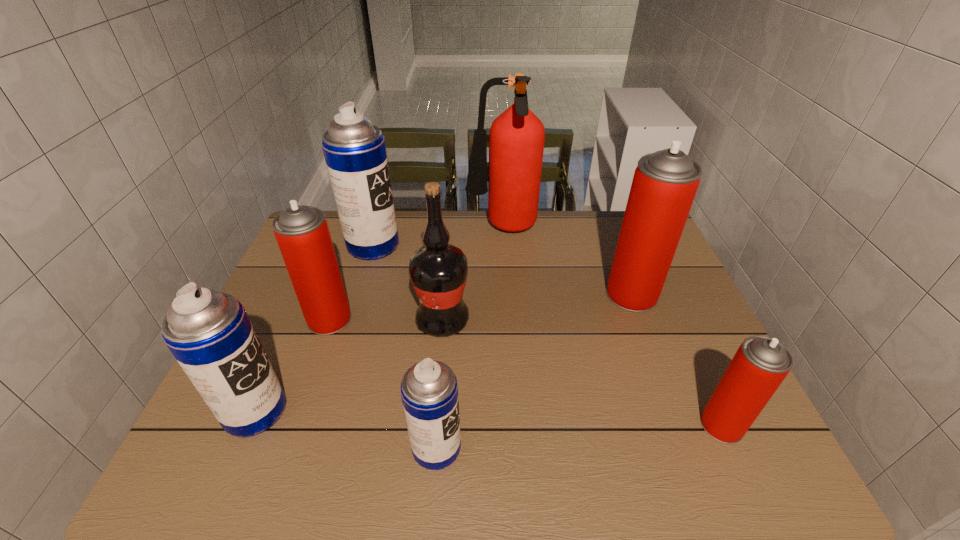
The image size is (960, 540). I want to click on the second closest object to the second smallest blue aerosol can, so click(x=429, y=390).

You are a GUI agent. You are given a task and a screenshot of the screen. Output one action in this format:
    pyautogui.click(x=<x>, y=<y>)
    Task: Click on the object that ranks as the sixth closest to the biggest red aerosol can
    The image size is (960, 540).
    Given the screenshot: What is the action you would take?
    pyautogui.click(x=302, y=233)

Identify which aerosol can is the nearest to the biggest red aerosol can. Please provide its 2D coordinates. Your answer should be formatted as a tuple, i.e. [(x, y)], where the tuple contains the x and y coordinates of a point satisfying the conditions above.

[(760, 365)]

At what (x,y) coordinates should I click in order to perform the action: click on aerosol can that is the third closest to the red fire extinguisher. Please return your answer as a coordinate pair (x, y). This screenshot has height=540, width=960. Looking at the image, I should click on (302, 233).

Select which blue aerosol can appears as the closest to the biggest red aerosol can. Please provide its 2D coordinates. Your answer should be formatted as a tuple, i.e. [(x, y)], where the tuple contains the x and y coordinates of a point satisfying the conditions above.

[(429, 390)]

Image resolution: width=960 pixels, height=540 pixels. I want to click on the second closest blue aerosol can to the red wine bottle, so click(x=429, y=390).

The height and width of the screenshot is (540, 960). What are the coordinates of `red aerosol can identified as the closest to the smallest blue aerosol can` in the screenshot? It's located at (302, 233).

Point out which red aerosol can is positioned as the nearest to the red fire extinguisher. Please provide its 2D coordinates. Your answer should be formatted as a tuple, i.e. [(x, y)], where the tuple contains the x and y coordinates of a point satisfying the conditions above.

[(664, 185)]

You are a GUI agent. You are given a task and a screenshot of the screen. Output one action in this format:
    pyautogui.click(x=<x>, y=<y>)
    Task: Click on the free spot that satisfies the following two spatial constraints: 1. on the back side of the biggest red aerosol can; 2. at the nozzle of the red fire extinguisher
    
    Given the screenshot: What is the action you would take?
    pyautogui.click(x=608, y=230)

Locate an element on the screen. The image size is (960, 540). vacant space that satisfies the following two spatial constraints: 1. on the back side of the nearest red aerosol can; 2. at the nozzle of the red fire extinguisher is located at coordinates (633, 230).